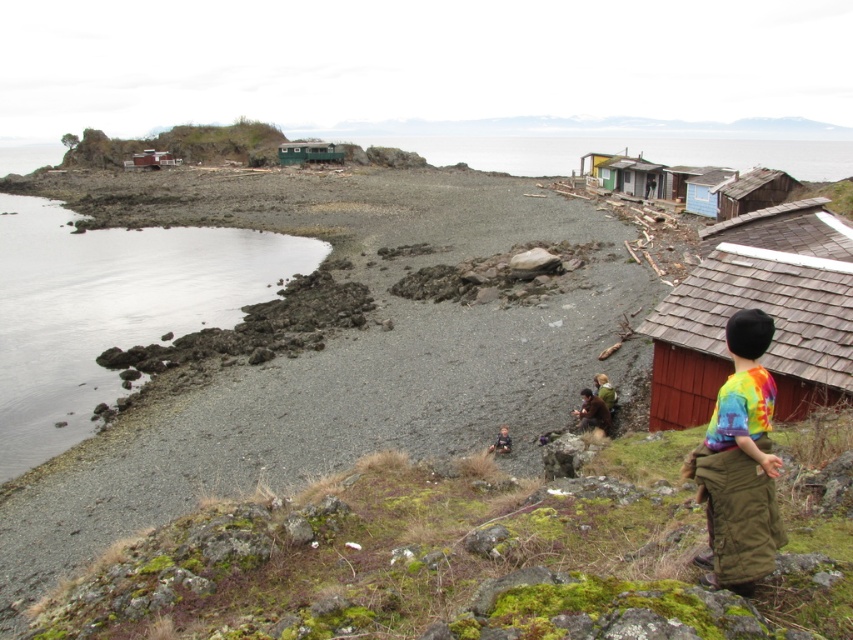
You are standing on the pebble beach looking towards the shoreline. You see a green weathered wood hut at center and a green fabric jacket at center. Which object is positioned to the left when viewed from your perspective?

The green weathered wood hut at center is to the left of the green fabric jacket at center from your perspective.

You are standing at the coordinates 0,0. You want to reach the green weathered wood hut at center. Which direction should you move in?

You should move towards the coordinates (308, 152) to reach the green weathered wood hut at center.